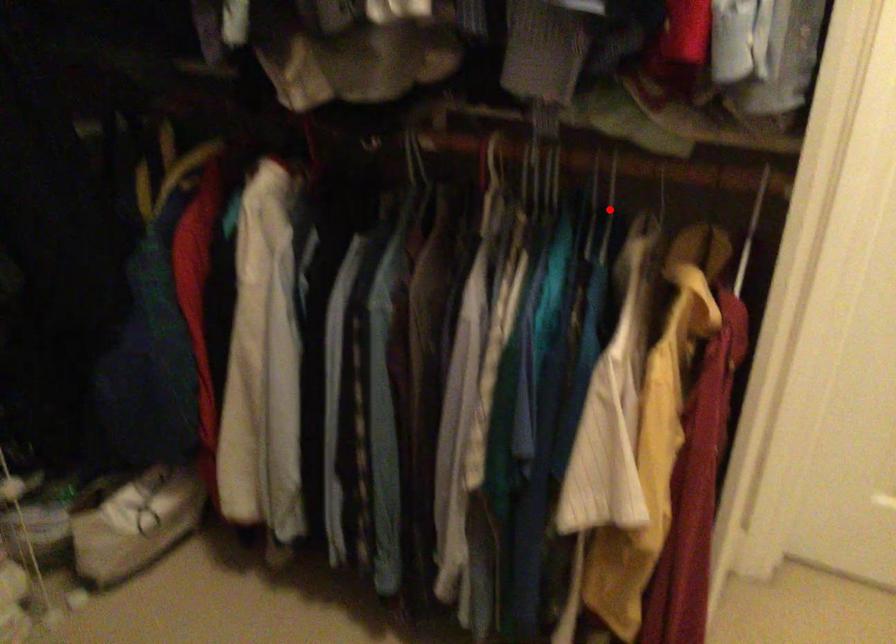
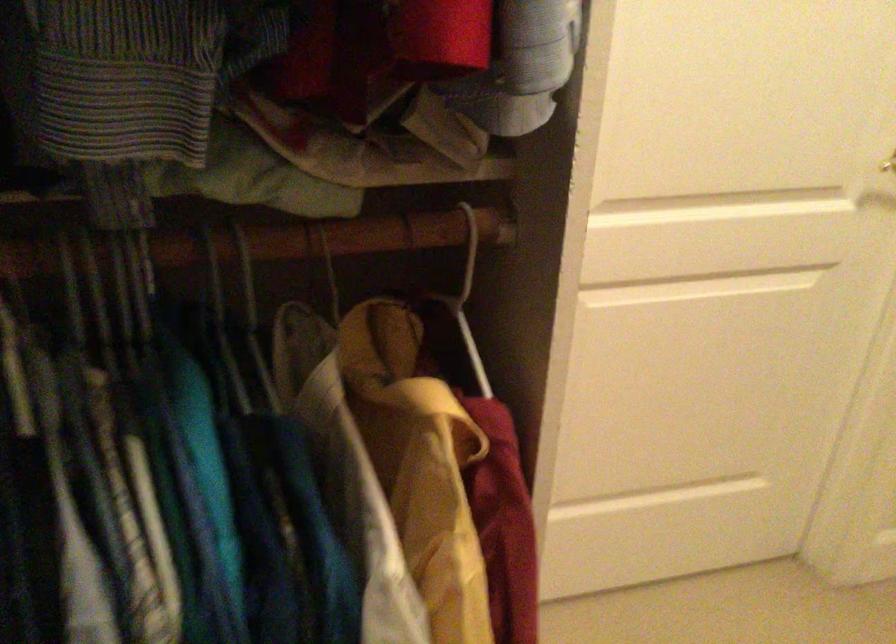
The point at the highlighted location is marked in the first image. Where is the corresponding point in the second image?

(174, 296)